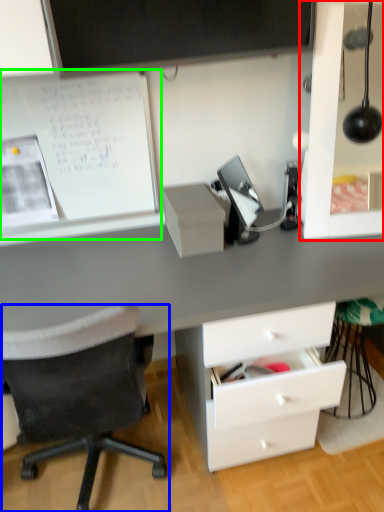
Question: Which object is positioned farthest from dresser (highlighted by a red box)? Select from chair (highlighted by a blue box) and bulletin board (highlighted by a green box).

Choices:
 (A) chair
 (B) bulletin board

Answer: (A)